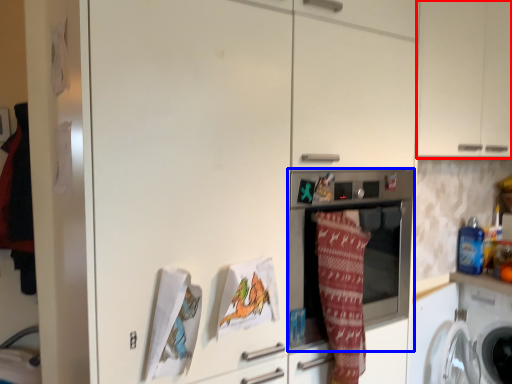
Question: Which object appears farthest to the camera in this image, cabinetry (highlighted by a red box) or home appliance (highlighted by a blue box)?

Choices:
 (A) cabinetry
 (B) home appliance

Answer: (A)